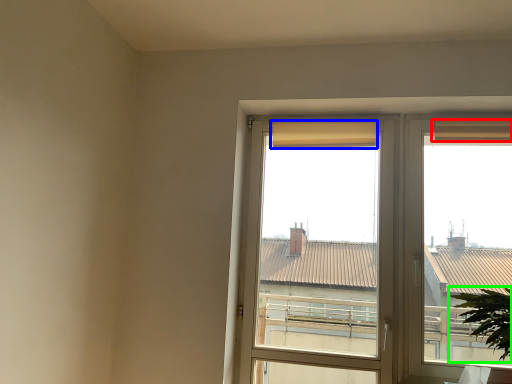
Question: Based on their relative distances, which object is farther from curtain (highlighted by a red box)? Choose from curtain (highlighted by a blue box) and houseplant (highlighted by a green box).

Choices:
 (A) curtain
 (B) houseplant

Answer: (B)